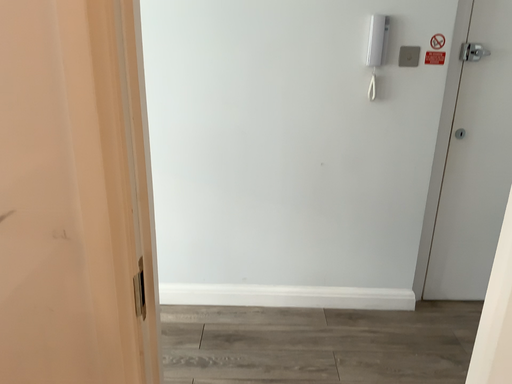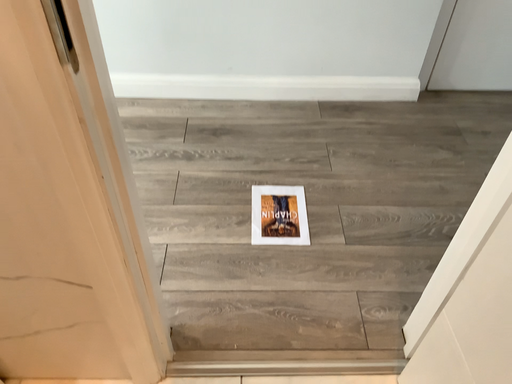
Question: How did the camera likely rotate when shooting the video?

Choices:
 (A) rotated downward
 (B) rotated upward

Answer: (A)